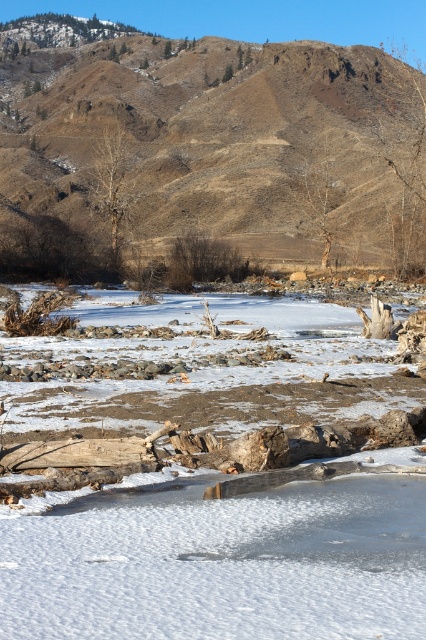
Is white matte snow at center closer to the viewer compared to brown/dry soil at upper center?

That is True.

Can you confirm if white matte snow at center is positioned above brown/dry soil at upper center?

No, white matte snow at center is not above brown/dry soil at upper center.

What do you see at coordinates (216, 561) in the screenshot? This screenshot has width=426, height=640. I see `white matte snow at center` at bounding box center [216, 561].

At what (x,y) coordinates should I click in order to perform the action: click on white matte snow at center. Please return your answer as a coordinate pair (x, y). Image resolution: width=426 pixels, height=640 pixels. Looking at the image, I should click on (216, 561).